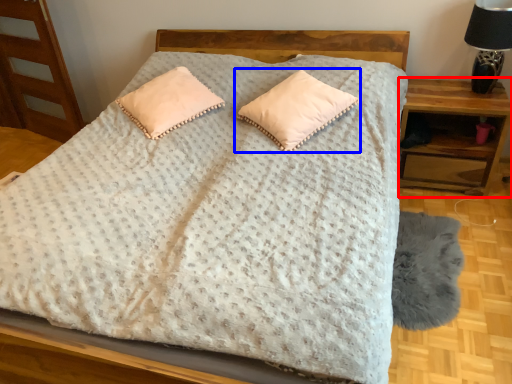
Question: Which object appears farthest to the camera in this image, nightstand (highlighted by a red box) or pillow (highlighted by a blue box)?

Choices:
 (A) nightstand
 (B) pillow

Answer: (A)